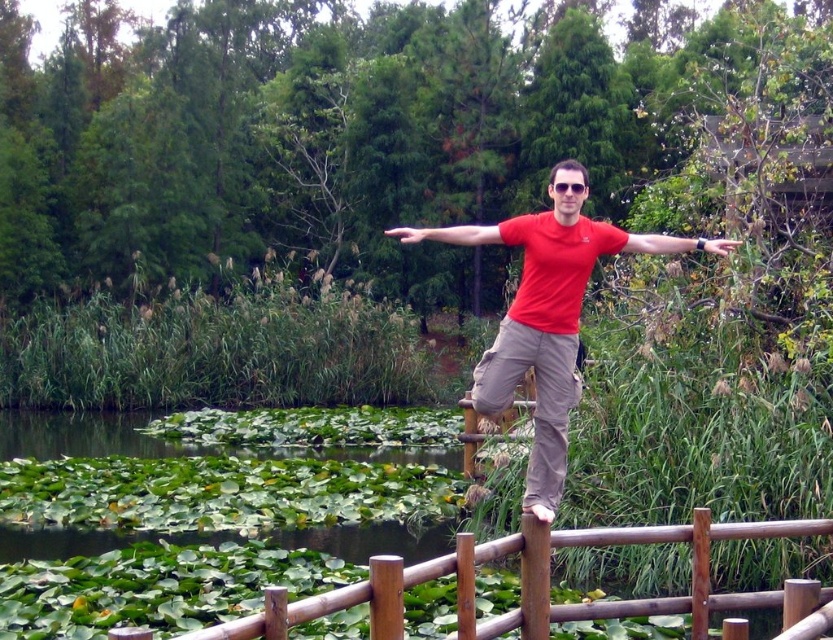
Question: Does brown wooden rail at center appear over red matte shirt at center?

Choices:
 (A) no
 (B) yes

Answer: (A)

Question: In this image, where is brown wooden rail at center located relative to red matte shirt at center?

Choices:
 (A) left
 (B) right

Answer: (A)

Question: Among these points, which one is nearest to the camera?

Choices:
 (A) (469, 243)
 (B) (691, 636)

Answer: (A)

Question: Which object is farther from the camera taking this photo?

Choices:
 (A) red matte shirt at center
 (B) brown wooden rail at center

Answer: (B)

Question: Among these objects, which one is farthest from the camera?

Choices:
 (A) brown wooden rail at center
 (B) red matte shirt at center

Answer: (A)

Question: Is brown wooden rail at center smaller than red matte shirt at center?

Choices:
 (A) yes
 (B) no

Answer: (A)